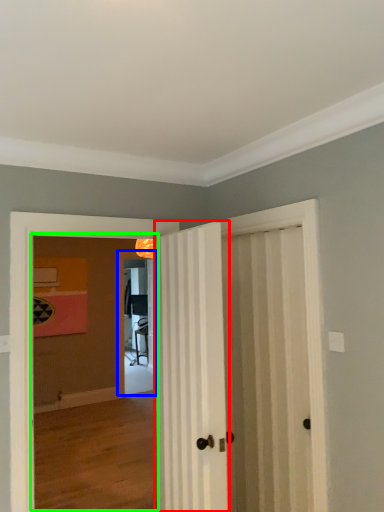
Question: Considering the real-world distances, which object is closest to door (highlighted by a red box)? screen door (highlighted by a blue box) or corridor (highlighted by a green box).

Choices:
 (A) screen door
 (B) corridor

Answer: (B)